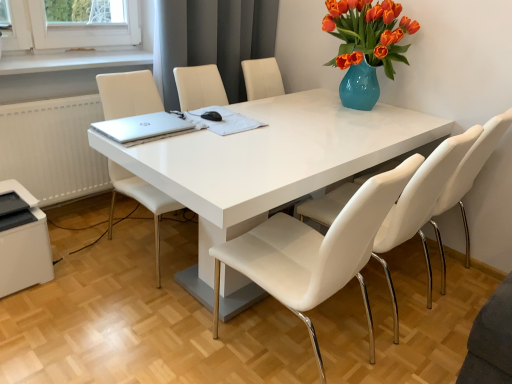
The width and height of the screenshot is (512, 384). In order to click on vacant region in front of silver metallic laptop at center in this screenshot , I will do `click(158, 150)`.